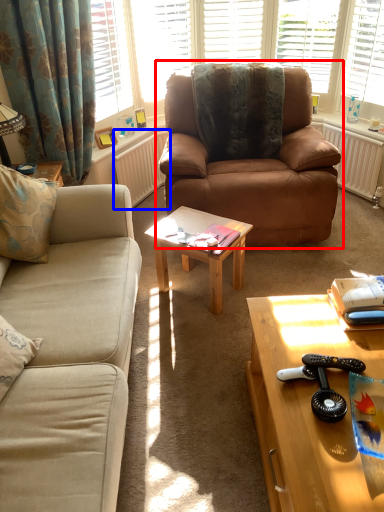
Question: Which of the following is the closest to the observer, studio couch (highlighted by a red box) or radiator (highlighted by a blue box)?

Choices:
 (A) studio couch
 (B) radiator

Answer: (A)